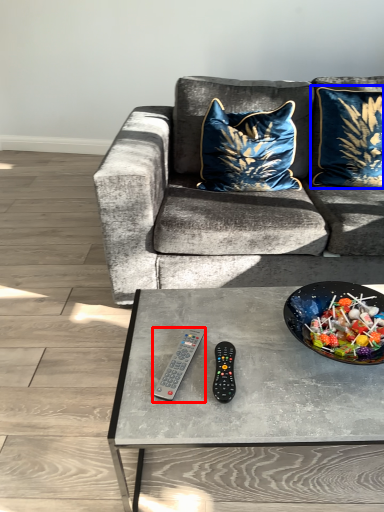
Question: Which object is closer to the camera taking this photo, remote control (highlighted by a red box) or pillow (highlighted by a blue box)?

Choices:
 (A) remote control
 (B) pillow

Answer: (A)